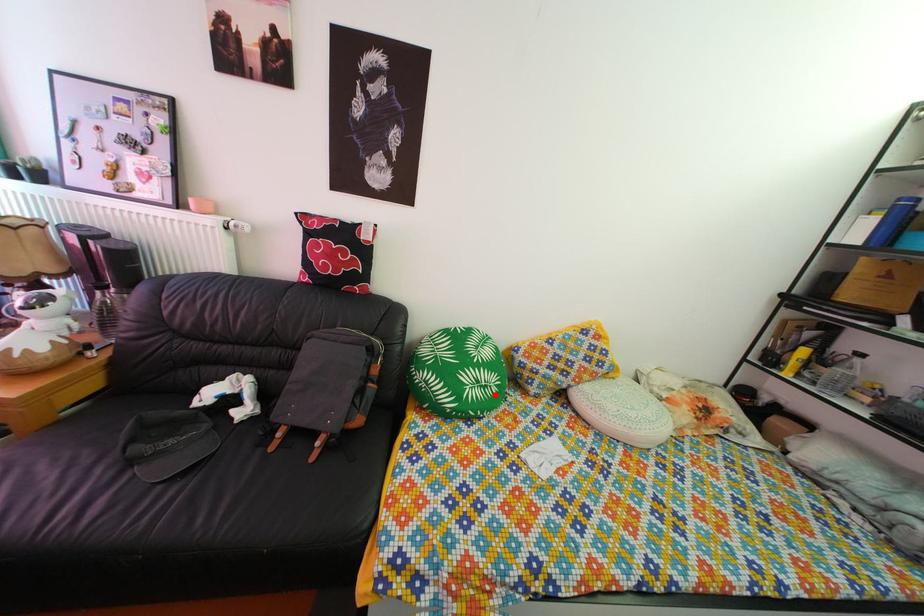
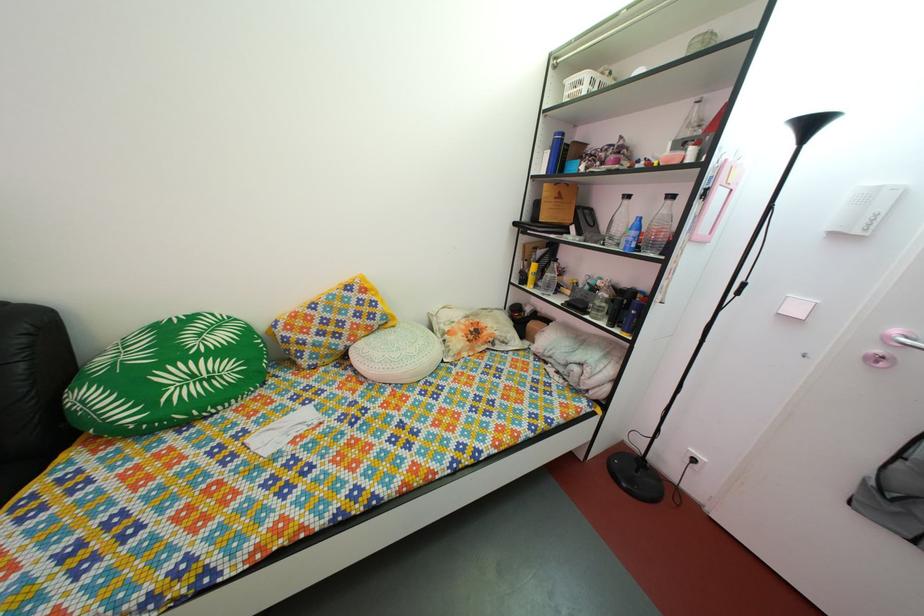
Question: I am providing you with two images of the same scene from different viewpoints. Image1 has a red point marked. In image2, the corresponding 3D location appears at what relative position? Reply with the corresponding letter.

Choices:
 (A) Closer
 (B) Farther

Answer: (A)